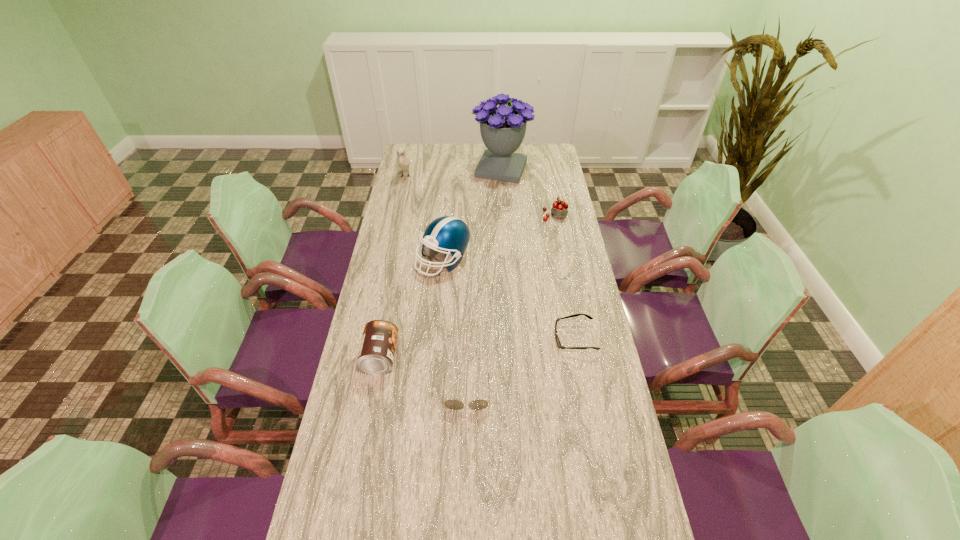
Where is `free space at the far edge of the desktop`? Image resolution: width=960 pixels, height=540 pixels. free space at the far edge of the desktop is located at coordinates (523, 151).

Image resolution: width=960 pixels, height=540 pixels. What are the coordinates of `free region at the left edge` in the screenshot? It's located at (343, 422).

Locate an element on the screen. vacant space at the right edge of the desktop is located at coordinates (604, 414).

The width and height of the screenshot is (960, 540). I want to click on free region at the far right corner of the desktop, so click(556, 152).

Image resolution: width=960 pixels, height=540 pixels. I want to click on empty location between the bird and the fourth farthest object, so click(x=424, y=218).

Where is `unoccupied area between the right sunglasses and the can`? The image size is (960, 540). unoccupied area between the right sunglasses and the can is located at coordinates (477, 348).

Image resolution: width=960 pixels, height=540 pixels. Identify the location of free space between the fourth farthest object and the tallest object. (472, 214).

At what (x,y) coordinates should I click in order to perform the action: click on vacant space that's between the cherry and the nearest object. Please return your answer as a coordinate pair (x, y). The height and width of the screenshot is (540, 960). Looking at the image, I should click on (511, 303).

You are a GUI agent. You are given a task and a screenshot of the screen. Output one action in this format:
    pyautogui.click(x=<x>, y=<y>)
    Task: Click on the free space between the bird and the nearest object
    This screenshot has width=960, height=540.
    Given the screenshot: What is the action you would take?
    pyautogui.click(x=436, y=285)

The width and height of the screenshot is (960, 540). Find the location of `blank region between the shorter sunglasses and the taller sunglasses`. blank region between the shorter sunglasses and the taller sunglasses is located at coordinates (520, 366).